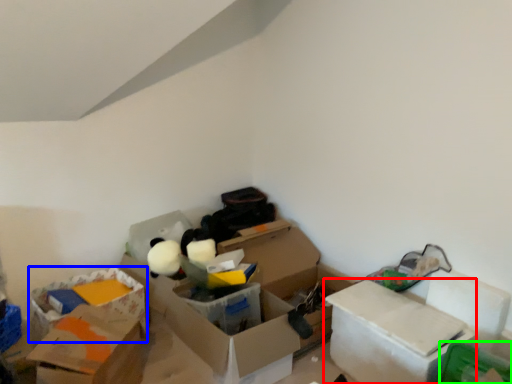
Question: Which object is the closest to the box (highlighted by a red box)? Choose among these: storage box (highlighted by a blue box) or storage box (highlighted by a green box).

Choices:
 (A) storage box
 (B) storage box

Answer: (B)